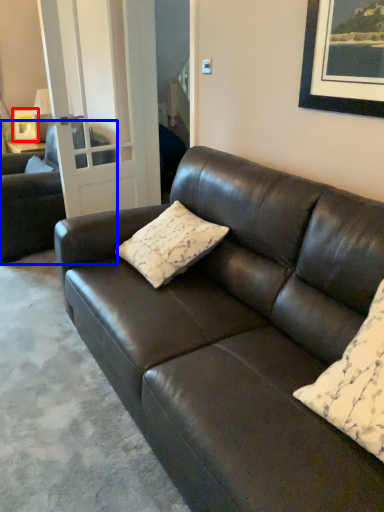
Question: Which object appears closest to the camera in this image, picture frame (highlighted by a red box) or studio couch (highlighted by a blue box)?

Choices:
 (A) picture frame
 (B) studio couch

Answer: (B)